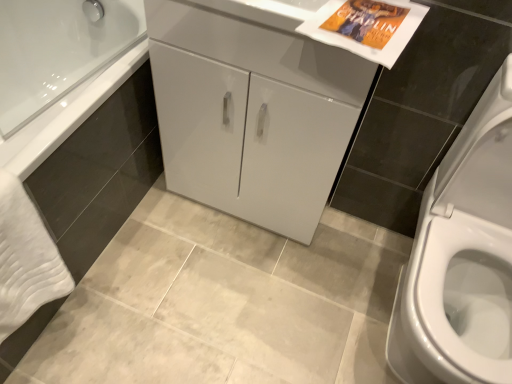
Question: Would you say white soft towel at lower left is to the left or to the right of white glossy cabinet at center in the picture?

Choices:
 (A) right
 (B) left

Answer: (B)

Question: From a real-world perspective, is white soft towel at lower left physically located above or below white glossy cabinet at center?

Choices:
 (A) above
 (B) below

Answer: (B)

Question: Based on their relative distances, which object is nearer to the white glossy cabinet at center?

Choices:
 (A) white glossy cabinet at center
 (B) white soft towel at lower left

Answer: (A)

Question: Which is nearer to the white glossy cabinet at center?

Choices:
 (A) white soft towel at lower left
 (B) white glossy cabinet at center

Answer: (B)